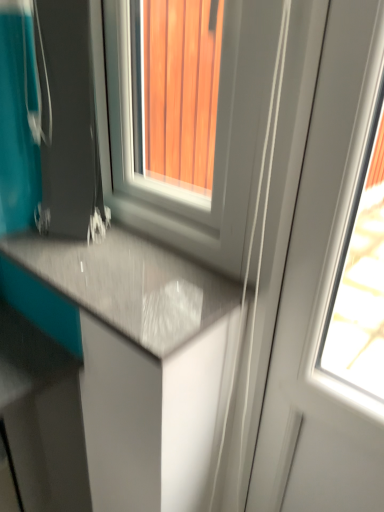
Question: From the image's perspective, is matte gray countertop at lower left located above white glossy screen door at right?

Choices:
 (A) no
 (B) yes

Answer: (B)

Question: Is matte gray countertop at lower left at the left side of white glossy screen door at right?

Choices:
 (A) no
 (B) yes

Answer: (B)

Question: Does matte gray countertop at lower left have a lesser height compared to white glossy screen door at right?

Choices:
 (A) yes
 (B) no

Answer: (A)

Question: From a real-world perspective, is matte gray countertop at lower left on top of white glossy screen door at right?

Choices:
 (A) yes
 (B) no

Answer: (A)

Question: Does matte gray countertop at lower left turn towards white glossy screen door at right?

Choices:
 (A) yes
 (B) no

Answer: (B)

Question: Is matte gray countertop at lower left at the right side of white glossy screen door at right?

Choices:
 (A) no
 (B) yes

Answer: (A)

Question: From a real-world perspective, is matte black suitcase at lower left positioned under matte gray countertop at lower left based on gravity?

Choices:
 (A) yes
 (B) no

Answer: (B)

Question: Can you see matte black suitcase at lower left touching matte gray countertop at lower left?

Choices:
 (A) no
 (B) yes

Answer: (A)

Question: Is matte black suitcase at lower left oriented away from matte gray countertop at lower left?

Choices:
 (A) no
 (B) yes

Answer: (A)

Question: Is matte black suitcase at lower left further to camera compared to matte gray countertop at lower left?

Choices:
 (A) yes
 (B) no

Answer: (B)

Question: From the image's perspective, does matte black suitcase at lower left appear lower than matte gray countertop at lower left?

Choices:
 (A) no
 (B) yes

Answer: (A)

Question: Is matte black suitcase at lower left positioned in front of matte gray countertop at lower left?

Choices:
 (A) yes
 (B) no

Answer: (A)

Question: Considering the relative sizes of matte gray countertop at lower left and white glossy window at center in the image provided, is matte gray countertop at lower left shorter than white glossy window at center?

Choices:
 (A) yes
 (B) no

Answer: (A)